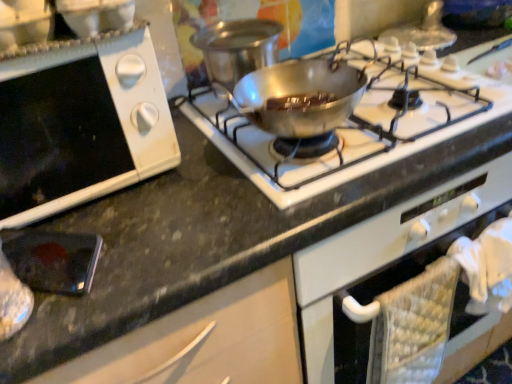
Locate an element on the screen. This screenshot has height=384, width=512. vacant area in front of metallic silver phone at lower left is located at coordinates (52, 328).